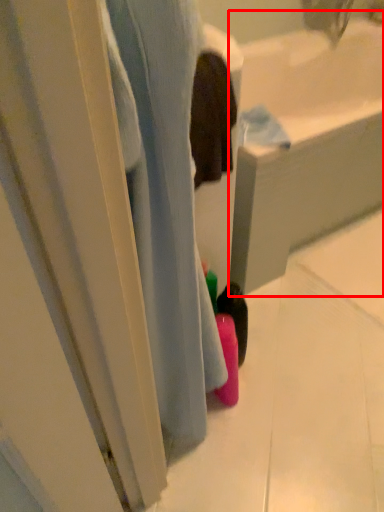
Question: From the image, what is the correct spatial relationship of bath (annotated by the red box) in relation to bath?

Choices:
 (A) left
 (B) right

Answer: (B)